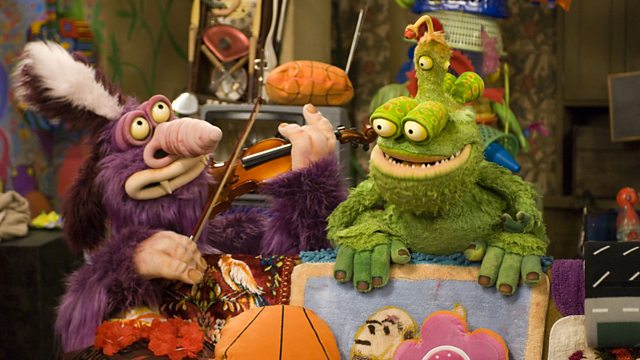
Identify the location of board. This screenshot has height=360, width=640. (x=614, y=101).